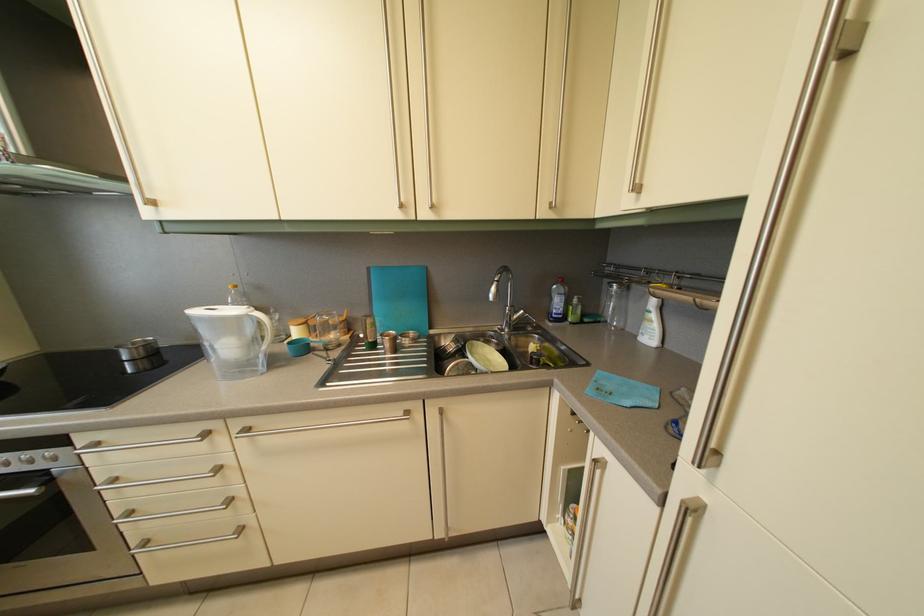
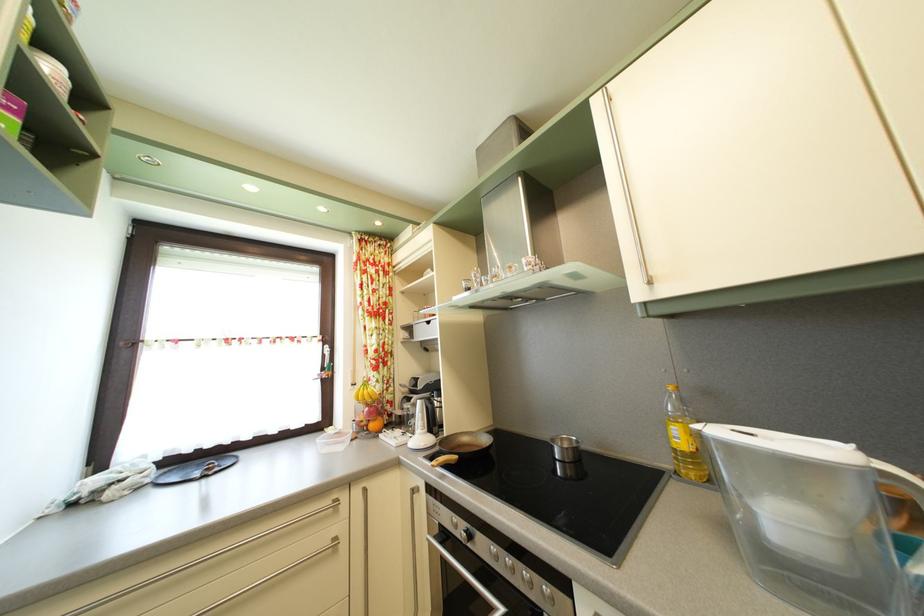
Where in the second image is the point corresponding to point (142, 351) from the first image?

(569, 448)